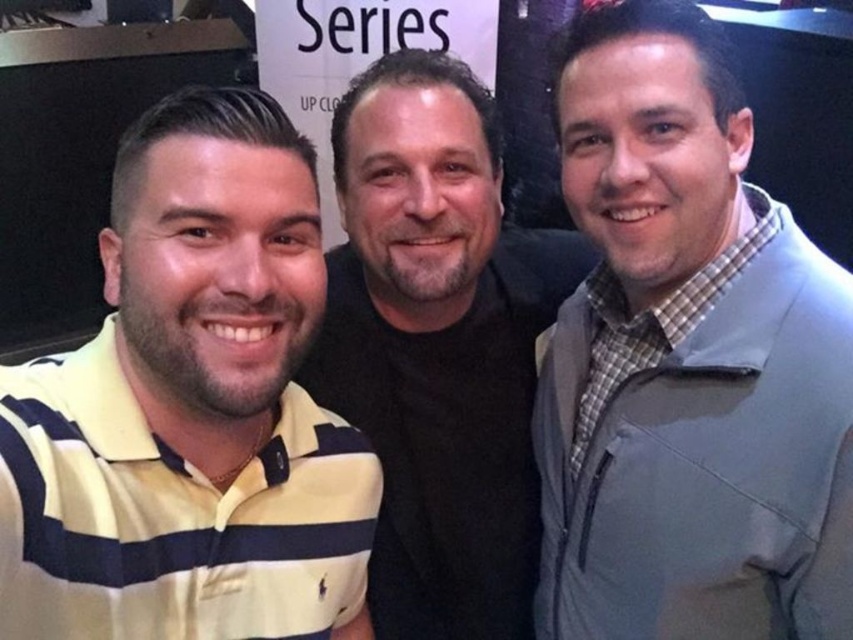
Question: Does yellow striped polo shirt at left have a lesser width compared to yellow striped polo shirt at right?

Choices:
 (A) yes
 (B) no

Answer: (B)

Question: Based on their relative distances, which object is nearer to the yellow striped polo shirt at right?

Choices:
 (A) yellow striped polo shirt at left
 (B) black matte shirt at center

Answer: (B)

Question: Based on their relative distances, which object is nearer to the yellow striped polo shirt at right?

Choices:
 (A) black matte shirt at center
 (B) yellow striped polo shirt at left

Answer: (A)

Question: Can you confirm if yellow striped polo shirt at right is bigger than black matte shirt at center?

Choices:
 (A) yes
 (B) no

Answer: (B)

Question: Can you confirm if yellow striped polo shirt at left is wider than yellow striped polo shirt at right?

Choices:
 (A) no
 (B) yes

Answer: (B)

Question: Estimate the real-world distances between objects in this image. Which object is farther from the yellow striped polo shirt at left?

Choices:
 (A) yellow striped polo shirt at right
 (B) black matte shirt at center

Answer: (A)